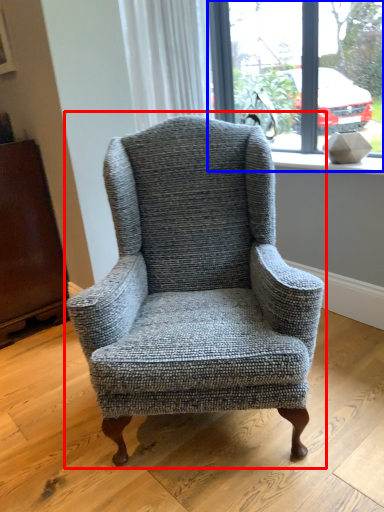
Question: Which of the following is the farthest to the observer, chair (highlighted by a red box) or window (highlighted by a blue box)?

Choices:
 (A) chair
 (B) window

Answer: (B)